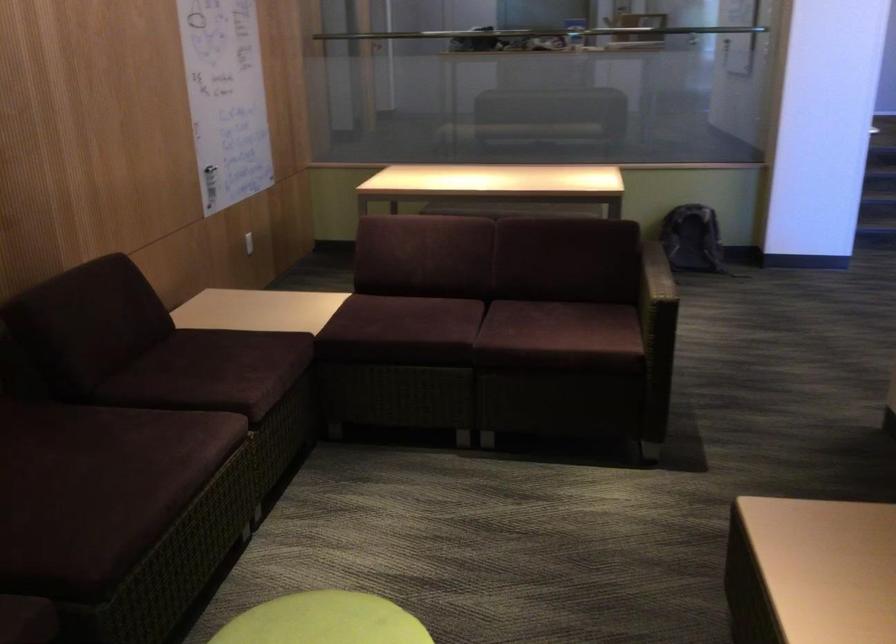
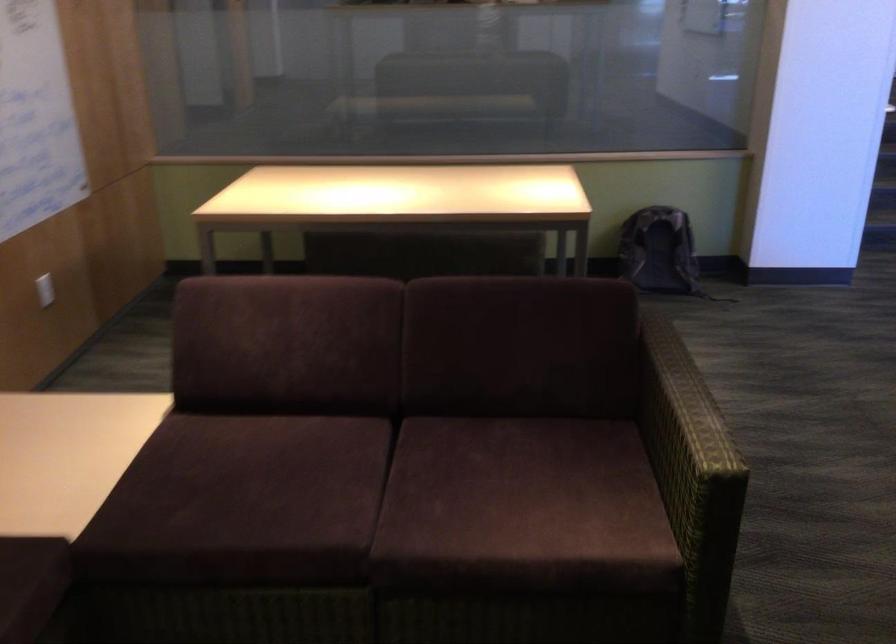
Question: Which direction would the cameraman need to move to produce the second image? Reply with the corresponding letter.

Choices:
 (A) Left
 (B) Right
 (C) Forward
 (D) Backward

Answer: (C)